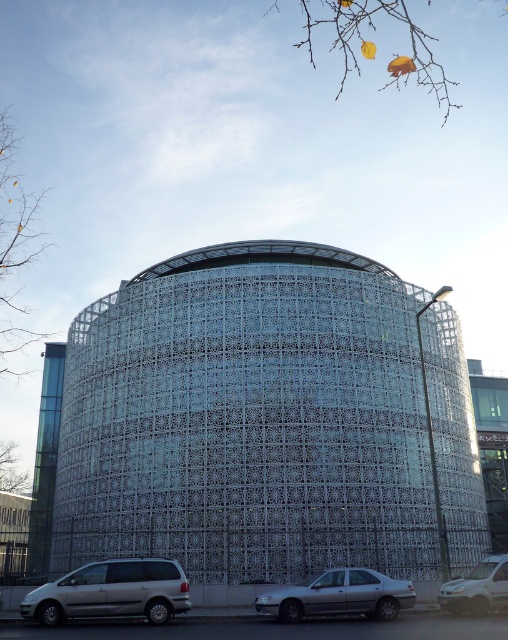
Is silver metallic van at lower left to the left of silver metallic car at lower center from the viewer's perspective?

Correct, you'll find silver metallic van at lower left to the left of silver metallic car at lower center.

Can you confirm if silver metallic van at lower left is wider than silver metallic car at lower center?

Indeed, silver metallic van at lower left has a greater width compared to silver metallic car at lower center.

The width and height of the screenshot is (508, 640). What do you see at coordinates (111, 592) in the screenshot? I see `silver metallic van at lower left` at bounding box center [111, 592].

The width and height of the screenshot is (508, 640). I want to click on silver metallic van at lower left, so click(x=111, y=592).

Does metallic grid structure at center have a greater height compared to white matte van at lower right?

Yes, metallic grid structure at center is taller than white matte van at lower right.

Which is behind, point (181, 488) or point (490, 586)?

Point (181, 488)

Locate an element on the screen. Image resolution: width=508 pixels, height=640 pixels. metallic grid structure at center is located at coordinates (247, 419).

Between silver metallic van at lower left and white matte van at lower right, which one is positioned lower?

silver metallic van at lower left is lower down.

Does silver metallic van at lower left appear on the right side of white matte van at lower right?

In fact, silver metallic van at lower left is to the left of white matte van at lower right.

Identify the location of silver metallic van at lower left. This screenshot has height=640, width=508. (111, 592).